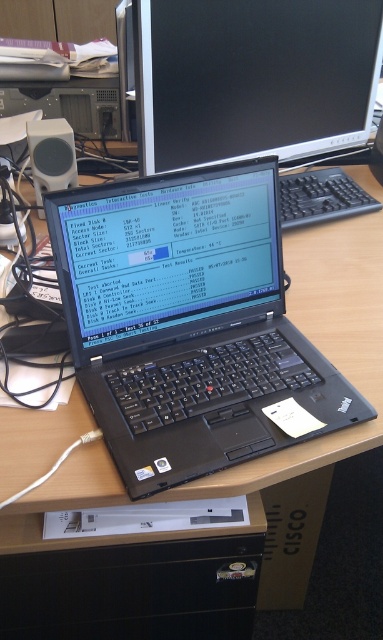
Question: Which object is positioned closest to the black plastic keyboard at center?

Choices:
 (A) black matte laptop at center
 (B) black glossy monitor at upper center

Answer: (B)

Question: Does black matte laptop at center appear on the right side of black glossy monitor at upper center?

Choices:
 (A) no
 (B) yes

Answer: (A)

Question: Which is farther from the black plastic keyboard at center?

Choices:
 (A) black matte laptop at center
 (B) black glossy monitor at upper center

Answer: (A)

Question: Which of the following is the farthest from the observer?

Choices:
 (A) (86, 392)
 (B) (332, 202)
 (C) (212, 10)

Answer: (B)

Question: Can you confirm if black matte laptop at center is bigger than black glossy monitor at upper center?

Choices:
 (A) yes
 (B) no

Answer: (B)

Question: Is black glossy monitor at upper center further to camera compared to black plastic keyboard at center?

Choices:
 (A) no
 (B) yes

Answer: (A)